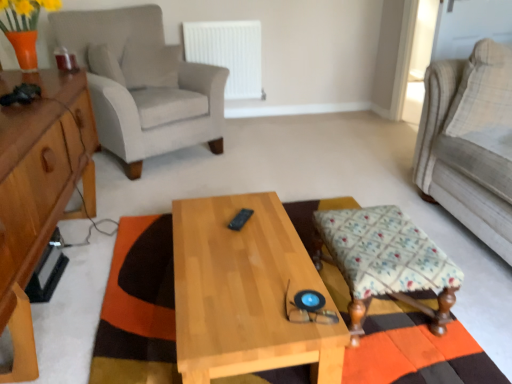
Question: Is light beige fabric couch at right not inside white plastic radiator at upper center?

Choices:
 (A) yes
 (B) no

Answer: (A)

Question: Does light beige fabric couch at right contain white plastic radiator at upper center?

Choices:
 (A) no
 (B) yes

Answer: (A)

Question: Is light beige fabric couch at right smaller than white plastic radiator at upper center?

Choices:
 (A) yes
 (B) no

Answer: (B)

Question: Does light beige fabric couch at right come in front of white plastic radiator at upper center?

Choices:
 (A) no
 (B) yes

Answer: (B)

Question: Does light beige fabric couch at right turn towards white plastic radiator at upper center?

Choices:
 (A) no
 (B) yes

Answer: (A)

Question: Considering the positions of light gray fabric armchair at left and white plastic radiator at upper center in the image, is light gray fabric armchair at left wider or thinner than white plastic radiator at upper center?

Choices:
 (A) thin
 (B) wide

Answer: (B)

Question: Choose the correct answer: Is light gray fabric armchair at left inside white plastic radiator at upper center or outside it?

Choices:
 (A) inside
 (B) outside

Answer: (B)

Question: Considering their positions, is light gray fabric armchair at left located in front of or behind white plastic radiator at upper center?

Choices:
 (A) front
 (B) behind

Answer: (A)

Question: Would you say light gray fabric armchair at left is to the left or to the right of white plastic radiator at upper center in the picture?

Choices:
 (A) left
 (B) right

Answer: (A)

Question: Is fluffy beige pillow at right inside the boundaries of light wood/texture coffee table at center, or outside?

Choices:
 (A) outside
 (B) inside

Answer: (A)

Question: From the image's perspective, is fluffy beige pillow at right positioned above or below light wood/texture coffee table at center?

Choices:
 (A) below
 (B) above

Answer: (B)

Question: Considering the positions of fluffy beige pillow at right and light wood/texture coffee table at center in the image, is fluffy beige pillow at right bigger or smaller than light wood/texture coffee table at center?

Choices:
 (A) big
 (B) small

Answer: (B)

Question: Looking at their shapes, would you say fluffy beige pillow at right is wider or thinner than light wood/texture coffee table at center?

Choices:
 (A) thin
 (B) wide

Answer: (A)

Question: From the image's perspective, is light gray fabric armchair at left positioned above or below fluffy beige pillow at right?

Choices:
 (A) above
 (B) below

Answer: (A)

Question: Would you say light gray fabric armchair at left is inside or outside fluffy beige pillow at right?

Choices:
 (A) inside
 (B) outside

Answer: (B)